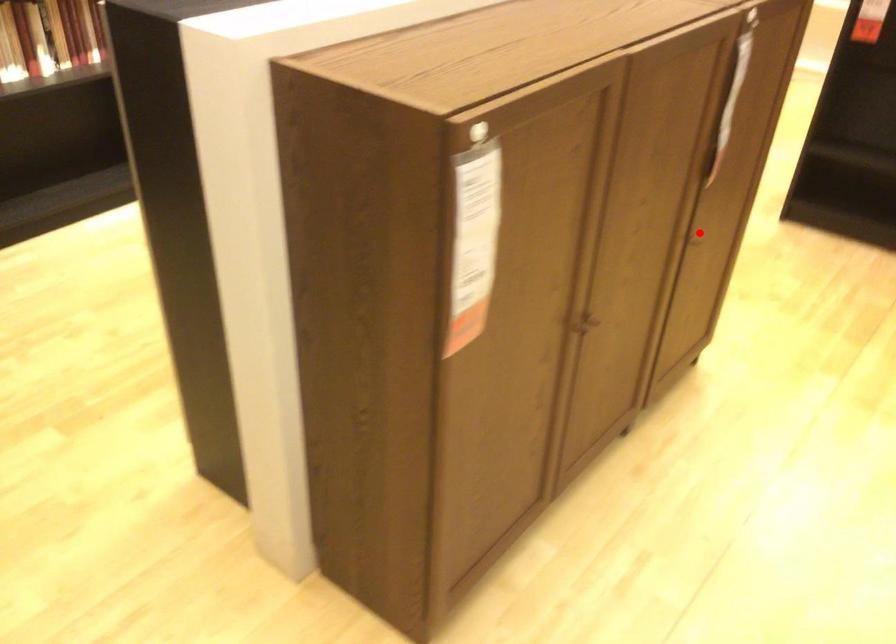
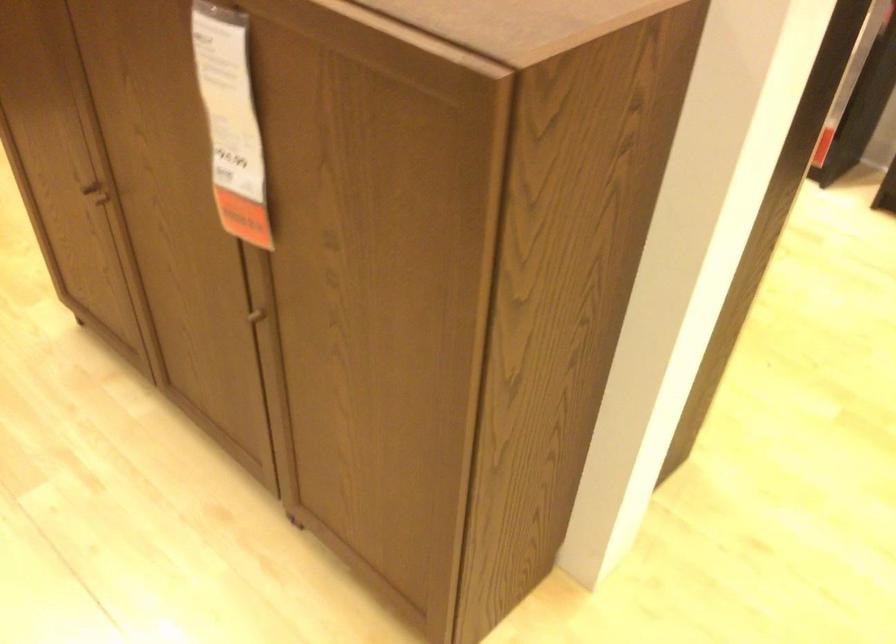
Where in the second image is the point corresponding to the highlighted location from the first image?

(262, 314)